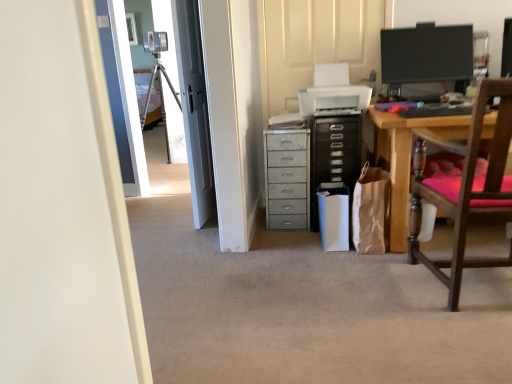
At what (x,y) coordinates should I click in order to perform the action: click on free location to the left of wooden chair with pink cushion at right. Please return your answer as a coordinate pair (x, y). Looking at the image, I should click on (377, 304).